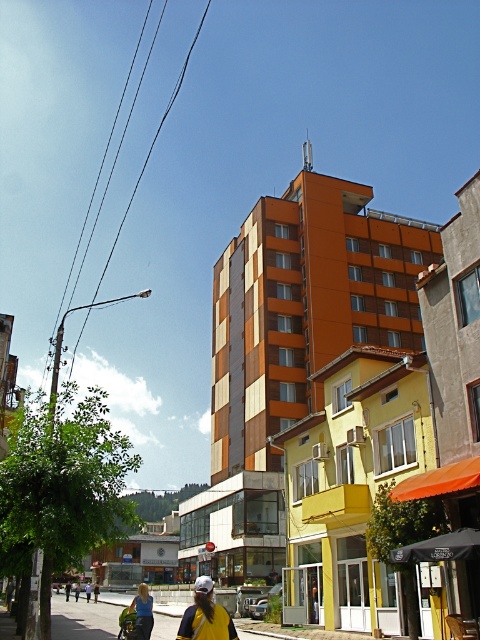
You are a photographer standing on the street in front of the orange building. You want to take a photo that includes both the yellow fabric cap at center and the yellow fabric umbrella at center. Which object should you focus on first to ensure both are in sharp focus?

You should focus on the yellow fabric cap at center first since it is closer to the viewer than the yellow fabric umbrella at center. By focusing on the closer object, the umbrella will still be within the depth of field and in focus.

You are standing at the point with coordinates point (x=135, y=625) and want to walk towards the point with coordinates point (x=73, y=586). Which direction should you walk to move closer to your destination?

To move closer to point (x=73, y=586) from point (x=135, y=625), you should walk towards the left and downward direction since point (x=135, y=625) is in front of point (x=73, y=586).